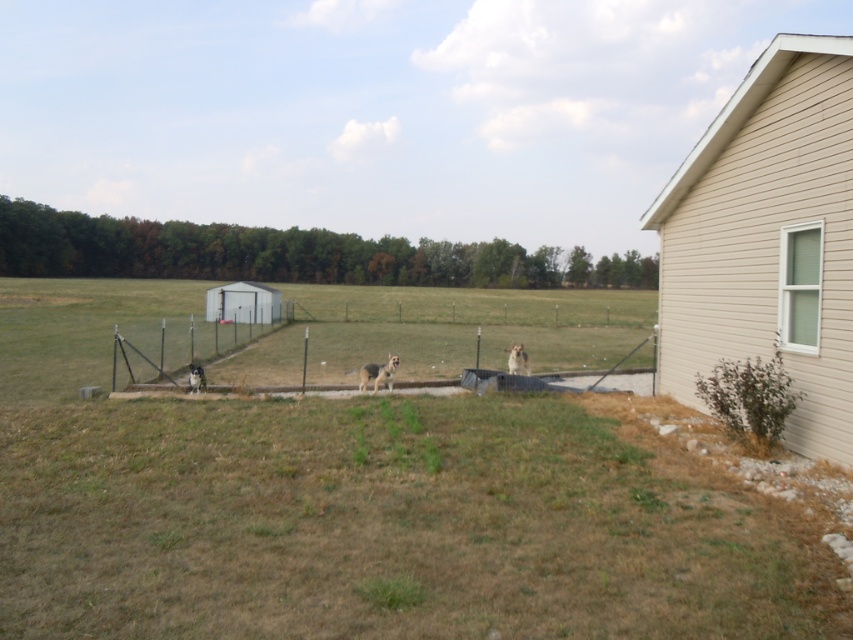
Is gray wire fence at center bigger than golden fur dog at center?

Yes.

Does point (122, 362) lie in front of point (389, 364)?

No, (122, 362) is behind (389, 364).

This screenshot has width=853, height=640. Identify the location of gray wire fence at center. (184, 346).

Can you confirm if gray wire fence at center is taller than fuzzy brown dog at center?

Indeed, gray wire fence at center has a greater height compared to fuzzy brown dog at center.

Consider the image. Measure the distance between gray wire fence at center and camera.

gray wire fence at center and camera are 13.98 meters apart from each other.

Does point (137, 344) come behind point (523, 356)?

Yes, it is.

Locate an element on the screen. The width and height of the screenshot is (853, 640). gray wire fence at center is located at coordinates (184, 346).

Who is more forward, (218, 326) or (257, 333)?

Point (257, 333)

Is point (177, 340) positioned before point (289, 307)?

Yes, it is in front of point (289, 307).

Find the location of a particular element. This screenshot has height=640, width=853. metallic wire fence at center is located at coordinates (363, 348).